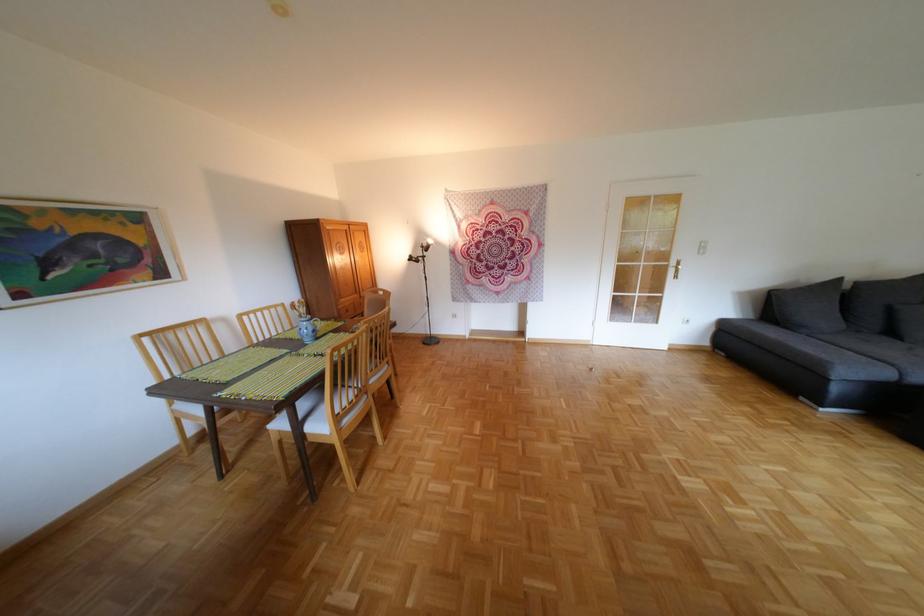
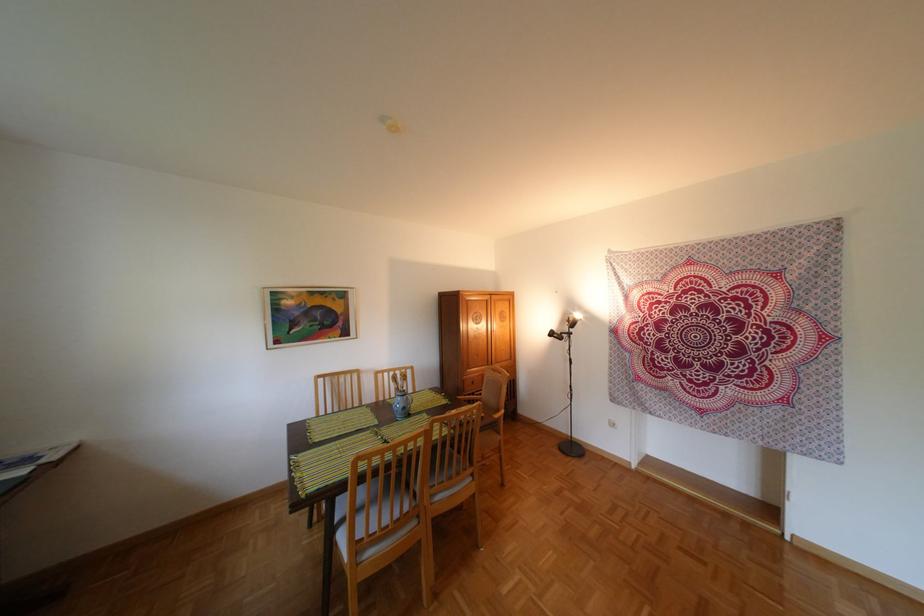
Question: The images are taken continuously from a first-person perspective. In which direction is your viewpoint rotating?

Choices:
 (A) Left
 (B) Right
 (C) Up
 (D) Down

Answer: (A)